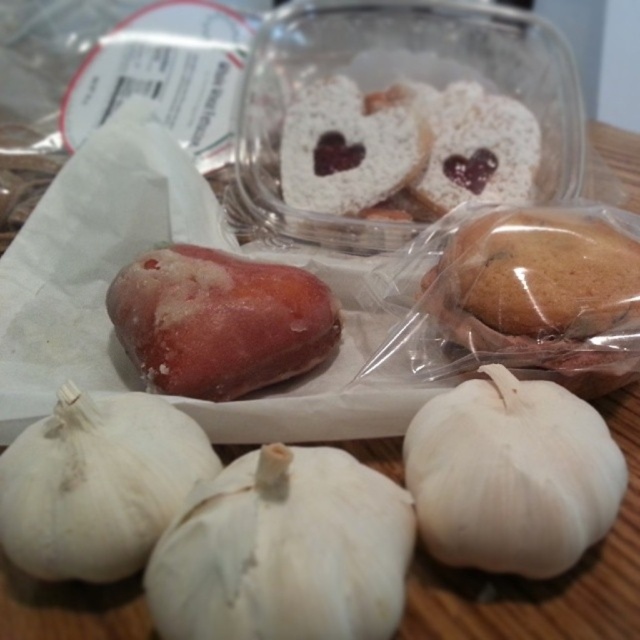
You are arranging food items on a wooden surface. You have a white matte garlic at lower center. Where exactly is the white matte garlic positioned in terms of coordinates?

The white matte garlic at lower center is located at point (512,474).